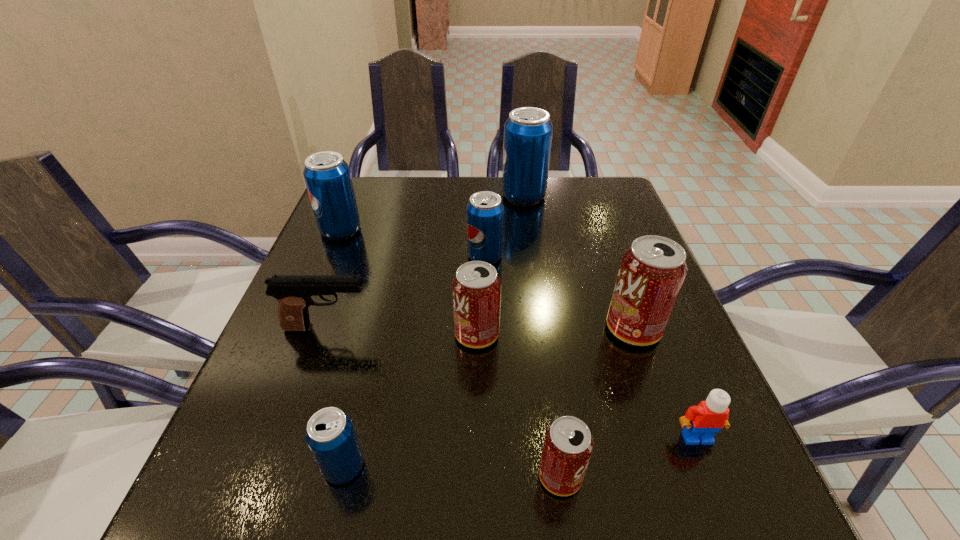
Identify the location of free location that satisfies the following two spatial constraints: 1. at the barrel of the pistol; 2. on the left side of the nearest blue pop soda. Image resolution: width=960 pixels, height=540 pixels. (279, 466).

Find the location of a particular element. vacant point that satisfies the following two spatial constraints: 1. at the barrel of the rightmost soda can; 2. on the right side of the pistol is located at coordinates (327, 329).

Locate an element on the screen. The height and width of the screenshot is (540, 960). free space that satisfies the following two spatial constraints: 1. on the back side of the third blue pop soda from right to left; 2. on the left side of the leftmost red soda can is located at coordinates (374, 334).

Where is `vacant area that satisfies the following two spatial constraints: 1. at the barrel of the rightmost red soda can; 2. on the right side of the pistol`? The height and width of the screenshot is (540, 960). vacant area that satisfies the following two spatial constraints: 1. at the barrel of the rightmost red soda can; 2. on the right side of the pistol is located at coordinates (327, 329).

Find the location of a particular element. The width and height of the screenshot is (960, 540). free spot that satisfies the following two spatial constraints: 1. on the front side of the farthest object; 2. at the barrel of the pistol is located at coordinates click(542, 328).

Find the location of a particular element. free region that satisfies the following two spatial constraints: 1. at the barrel of the pistol; 2. on the right side of the second red soda can from left to right is located at coordinates (276, 476).